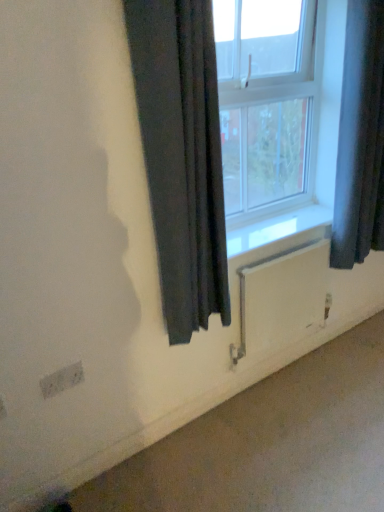
Question: Is white textured electric outlet at lower left at the back of smooth concrete at lower right?

Choices:
 (A) yes
 (B) no

Answer: (B)

Question: Considering the relative sizes of smooth concrete at lower right and white textured electric outlet at lower left in the image provided, is smooth concrete at lower right thinner than white textured electric outlet at lower left?

Choices:
 (A) no
 (B) yes

Answer: (A)

Question: Does smooth concrete at lower right have a larger size compared to white textured electric outlet at lower left?

Choices:
 (A) no
 (B) yes

Answer: (B)

Question: Is smooth concrete at lower right surrounding white textured electric outlet at lower left?

Choices:
 (A) no
 (B) yes

Answer: (A)

Question: From the image's perspective, does smooth concrete at lower right appear lower than white textured electric outlet at lower left?

Choices:
 (A) no
 (B) yes

Answer: (B)

Question: Considering the relative sizes of smooth concrete at lower right and white textured electric outlet at lower left in the image provided, is smooth concrete at lower right shorter than white textured electric outlet at lower left?

Choices:
 (A) yes
 (B) no

Answer: (A)

Question: Is black fabric curtain at center, which appears as the 1th curtain when viewed from the left, next to white plastic window at center and touching it?

Choices:
 (A) yes
 (B) no

Answer: (B)

Question: Is black fabric curtain at center, the second curtain in the right-to-left sequence, looking in the opposite direction of white plastic window at center?

Choices:
 (A) no
 (B) yes

Answer: (A)

Question: Does black fabric curtain at center, which appears as the 1th curtain when viewed from the left, appear on the left side of white plastic window at center?

Choices:
 (A) no
 (B) yes

Answer: (B)

Question: Can you confirm if black fabric curtain at center, which appears as the 1th curtain when viewed from the left, is thinner than white plastic window at center?

Choices:
 (A) no
 (B) yes

Answer: (A)

Question: From a real-world perspective, is black fabric curtain at center, the second curtain in the right-to-left sequence, physically above white plastic window at center?

Choices:
 (A) no
 (B) yes

Answer: (A)

Question: From the image's perspective, is black fabric curtain at center, which appears as the 1th curtain when viewed from the left, beneath white plastic window at center?

Choices:
 (A) no
 (B) yes

Answer: (B)

Question: Is dark fabric curtain at right, acting as the 1th curtain starting from the right, aimed at white matte radiator at lower center?

Choices:
 (A) yes
 (B) no

Answer: (B)